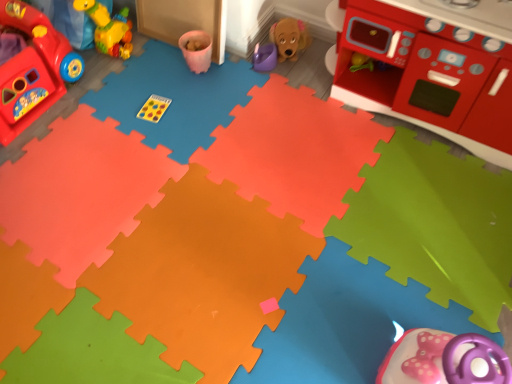
Question: In terms of height, does purple plastic watering can at center, which is the third toy in left-to-right order, look taller or shorter compared to rubber duck at upper left, which is counted as the second toy, starting from the left?

Choices:
 (A) tall
 (B) short

Answer: (B)

Question: Choose the correct answer: Is purple plastic watering can at center, the first toy viewed from the right, inside rubber duck at upper left, which is the second toy in right-to-left order, or outside it?

Choices:
 (A) outside
 (B) inside

Answer: (A)

Question: Which of these objects is positioned farthest from the purple plastic watering can at center, which is the third toy in left-to-right order?

Choices:
 (A) smooth plastic toy stove at upper right
 (B) rubberized red play kitchen at left, the 1th toy viewed from the left
 (C) rubber duck at upper left, which is the second toy in right-to-left order

Answer: (B)

Question: Which object is positioned closest to the rubber duck at upper left, which is counted as the second toy, starting from the left?

Choices:
 (A) purple plastic watering can at center, which is the third toy in left-to-right order
 (B) rubberized red play kitchen at left, the 1th toy viewed from the left
 (C) smooth plastic toy stove at upper right

Answer: (B)